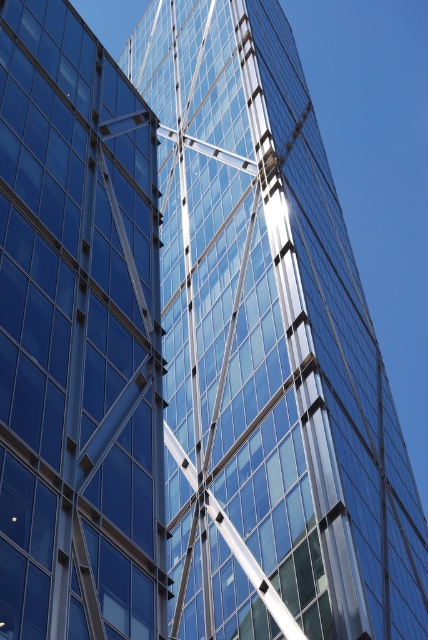
Is transparent glass building at center taller than transparent glass building at left?

Yes.

What do you see at coordinates (270, 346) in the screenshot? I see `transparent glass building at center` at bounding box center [270, 346].

Identify the location of transparent glass building at center. (270, 346).